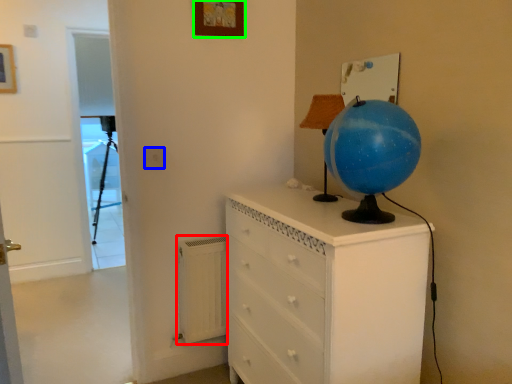
Question: Which object is positioned farthest from radiator (highlighted by a red box)? Select from electric outlet (highlighted by a blue box) and picture frame (highlighted by a green box).

Choices:
 (A) electric outlet
 (B) picture frame

Answer: (B)